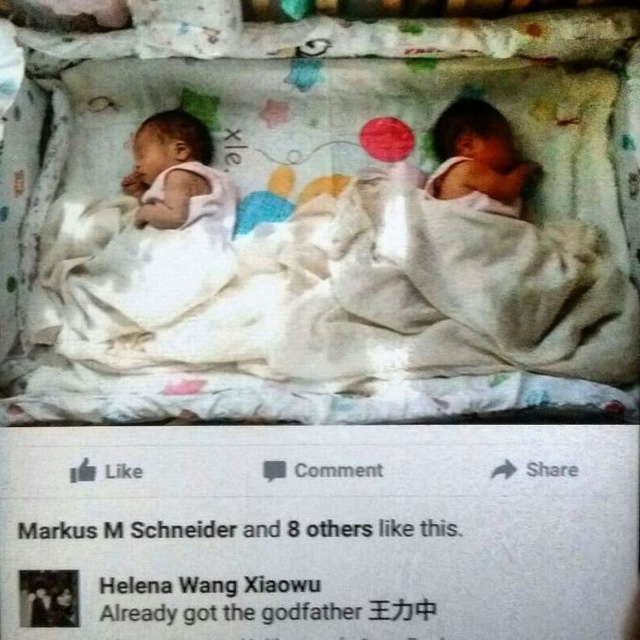
Who is lower down, white soft blanket at center or smooth skin newborn at right?

white soft blanket at center

Which of these two, white soft blanket at center or smooth skin newborn at right, stands shorter?

smooth skin newborn at right is shorter.

Does point (481, 205) lie behind point (467, 188)?

No, (481, 205) is closer to viewer.

Locate an element on the screen. The image size is (640, 640). white soft blanket at center is located at coordinates point(328,228).